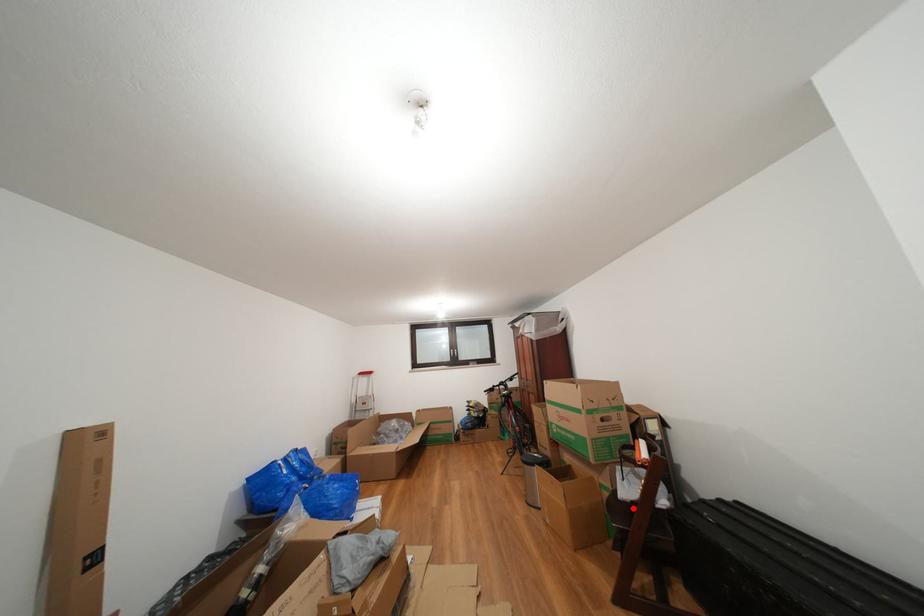
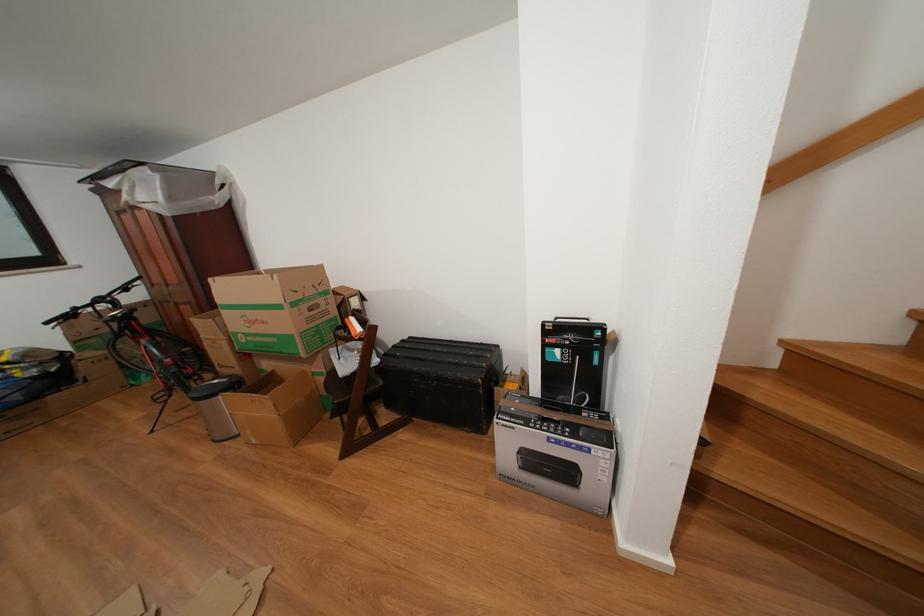
Where in the second image is the point corresponding to the highlighted location from the first image?

(354, 383)